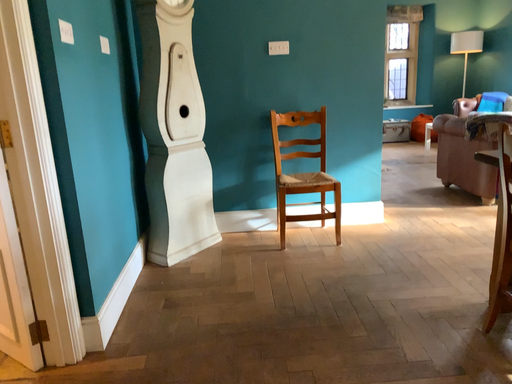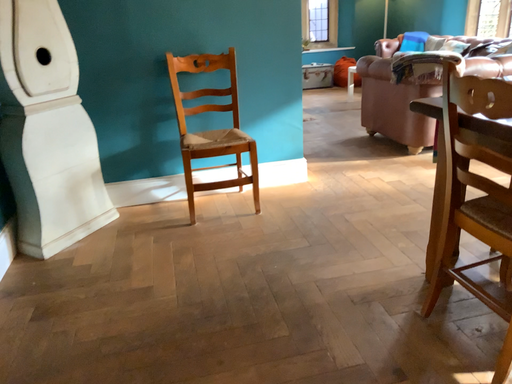
Question: Which way did the camera rotate in the video?

Choices:
 (A) rotated left
 (B) rotated right

Answer: (B)